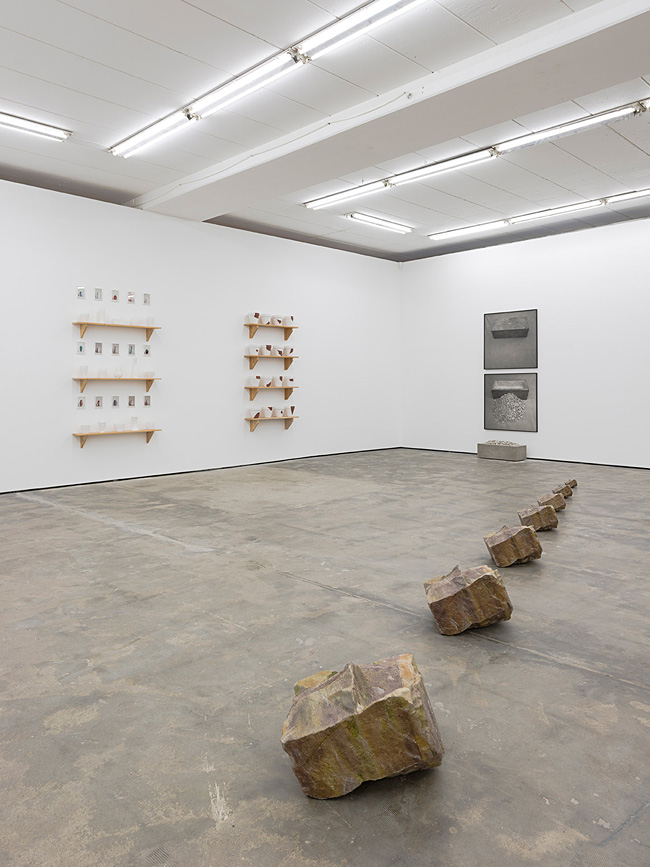
You are a GUI agent. You are given a task and a screenshot of the screen. Output one action in this format:
    pyautogui.click(x=<x>, y=<y>)
    Task: Click on the painting
    
    Given the screenshot: What is the action you would take?
    pyautogui.click(x=520, y=344), pyautogui.click(x=515, y=401)